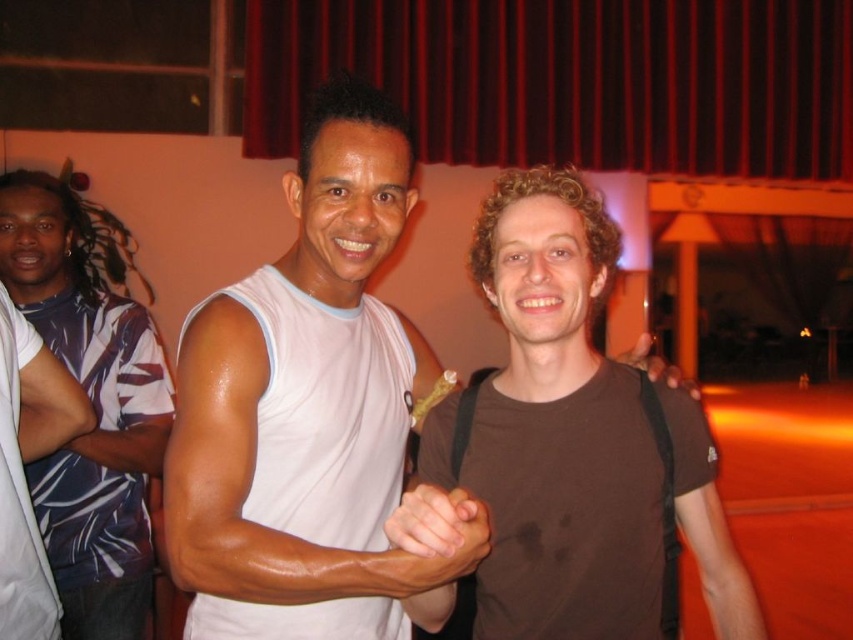
In the scene shown: Is brown matte t-shirt at center above white smooth tank top at center?

Yes.

Which is in front, point (427, 624) or point (171, 454)?

Point (171, 454)

Find the location of a particular element. The image size is (853, 640). brown matte t-shirt at center is located at coordinates (560, 428).

Can you confirm if brown fabric arm at center is positioned above white matte shirt at upper left?

Incorrect, brown fabric arm at center is not positioned above white matte shirt at upper left.

Does brown fabric arm at center appear under white matte shirt at upper left?

Indeed, brown fabric arm at center is positioned under white matte shirt at upper left.

What do you see at coordinates (718, 564) in the screenshot?
I see `brown fabric arm at center` at bounding box center [718, 564].

Image resolution: width=853 pixels, height=640 pixels. In order to click on brown fabric arm at center in this screenshot , I will do `click(718, 564)`.

Who is lower down, red velvet curtain at upper center or blue striped shirt at left?

blue striped shirt at left is lower down.

Between red velvet curtain at upper center and blue striped shirt at left, which one appears on the right side from the viewer's perspective?

red velvet curtain at upper center

This screenshot has width=853, height=640. Describe the element at coordinates (573, 81) in the screenshot. I see `red velvet curtain at upper center` at that location.

Locate an element on the screen. red velvet curtain at upper center is located at coordinates click(573, 81).